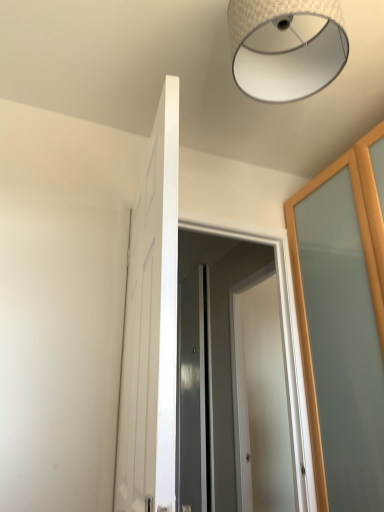
Question: Would you say woven fabric lampshade at upper center is inside or outside satin gray screen door at center?

Choices:
 (A) inside
 (B) outside

Answer: (B)

Question: From a real-world perspective, is woven fabric lampshade at upper center physically located above or below satin gray screen door at center?

Choices:
 (A) below
 (B) above

Answer: (B)

Question: Estimate the real-world distances between objects in this image. Which object is farther from the white glossy door at center, which ranks as the 1th door in left-to-right order?

Choices:
 (A) woven fabric lampshade at upper center
 (B) white glossy door at center, positioned as the 1th door in back-to-front order
 (C) satin gray screen door at center

Answer: (B)

Question: Estimate the real-world distances between objects in this image. Which object is farther from the white glossy door at center, which is counted as the first door, starting from the front?

Choices:
 (A) satin gray screen door at center
 (B) white glossy door at center, positioned as the 2th door in left-to-right order
 (C) woven fabric lampshade at upper center

Answer: (B)